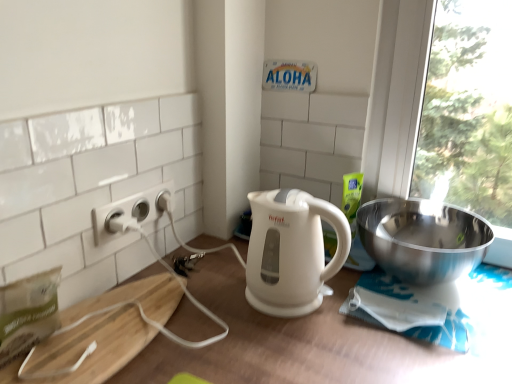
What do you see at coordinates (298, 343) in the screenshot? I see `white matte table at center` at bounding box center [298, 343].

Locate an element on the screen. white glossy electric kettle at center is located at coordinates (291, 251).

Locate an element on the screen. This screenshot has width=512, height=384. white plastic power outlet at left is located at coordinates (130, 213).

Image resolution: width=512 pixels, height=384 pixels. Find the location of `polished stainless steel bowl at right`. polished stainless steel bowl at right is located at coordinates (423, 239).

Where is `white matte table at center`? The width and height of the screenshot is (512, 384). white matte table at center is located at coordinates (298, 343).

Is white plastic power outlet at left turned away from white matte table at center?

No, white plastic power outlet at left is not facing away from white matte table at center.

Is white plastic power outlet at left beside white matte table at center?

white plastic power outlet at left is not next to white matte table at center, and they're not touching.

From the image's perspective, is white plastic power outlet at left on top of white matte table at center?

Yes, from the image's perspective, white plastic power outlet at left is above white matte table at center.

In the scene shown: Can you confirm if white plastic power outlet at left is bigger than white matte table at center?

Incorrect, white plastic power outlet at left is not larger than white matte table at center.

Considering the positions of objects white matte table at center and white glossy electric kettle at center in the image provided, who is more to the right, white matte table at center or white glossy electric kettle at center?

From the viewer's perspective, white matte table at center appears more on the right side.

Relative to white glossy electric kettle at center, is white matte table at center in front or behind?

In the image, white matte table at center appears in front of white glossy electric kettle at center.

From the image's perspective, which one is positioned lower, white matte table at center or white glossy electric kettle at center?

white matte table at center appears lower in the image.

From the picture: Is white matte table at center turned away from white glossy electric kettle at center?

No, white matte table at center's orientation is not away from white glossy electric kettle at center.

Considering the sizes of objects white matte table at center and polished stainless steel bowl at right in the image provided, who is taller, white matte table at center or polished stainless steel bowl at right?

Answer: white matte table at center.

What's the angular difference between white matte table at center and polished stainless steel bowl at right's facing directions?

They differ by 0.000495 degrees in their facing directions.

Which of these two, white matte table at center or polished stainless steel bowl at right, is wider?

Wider between the two is white matte table at center.

Based on their positions, is white glossy electric kettle at center located to the left or right of white matte table at center?

white glossy electric kettle at center is to the left of white matte table at center.

Which of these two, white glossy electric kettle at center or white matte table at center, stands shorter?

Standing shorter between the two is white glossy electric kettle at center.

Considering the relative positions of white glossy electric kettle at center and white matte table at center in the image provided, is white glossy electric kettle at center behind white matte table at center?

Yes, white glossy electric kettle at center is behind white matte table at center.

Is white glossy electric kettle at center facing away from white matte table at center?

No.

Would you say white plastic power outlet at left contains white glossy electric kettle at center?

No, white glossy electric kettle at center is not surrounded by white plastic power outlet at left.

Who is taller, white plastic power outlet at left or white glossy electric kettle at center?

white glossy electric kettle at center is taller.

From a real-world perspective, is white plastic power outlet at left above or below white glossy electric kettle at center?

In terms of real-world spatial position, white plastic power outlet at left is above white glossy electric kettle at center.

Locate an element on the screen. The width and height of the screenshot is (512, 384). power outlet above the white glossy electric kettle at center (from the image's perspective) is located at coordinates (130, 213).

Between polished stainless steel bowl at right and white matte table at center, which one has more height?

Standing taller between the two is white matte table at center.

Consider the image. Is polished stainless steel bowl at right to the right of white matte table at center from the viewer's perspective?

Correct, you'll find polished stainless steel bowl at right to the right of white matte table at center.

Find the location of a particular element. table in front of the polished stainless steel bowl at right is located at coordinates (298, 343).

Is polished stainless steel bowl at right wider than white matte table at center?

No.

How far apart are polished stainless steel bowl at right and white plastic power outlet at left?

The distance of polished stainless steel bowl at right from white plastic power outlet at left is 23.48 inches.

Is polished stainless steel bowl at right in front of or behind white plastic power outlet at left in the image?

polished stainless steel bowl at right is in front of white plastic power outlet at left.

Is polished stainless steel bowl at right inside the boundaries of white plastic power outlet at left, or outside?

The correct answer is: outside.

From the image's perspective, which is below, polished stainless steel bowl at right or white plastic power outlet at left?

polished stainless steel bowl at right.

Where is `power outlet located above the white matte table at center (from the image's perspective)`? power outlet located above the white matte table at center (from the image's perspective) is located at coordinates (130, 213).

This screenshot has width=512, height=384. I want to click on table below the white glossy electric kettle at center (from the image's perspective), so click(298, 343).

From the image, which object appears to be nearer to white plastic power outlet at left, polished stainless steel bowl at right or white glossy electric kettle at center?

white glossy electric kettle at center is closer to white plastic power outlet at left.

Looking at the image, which one is located closer to polished stainless steel bowl at right, white plastic power outlet at left or white matte table at center?

Among the two, white matte table at center is located nearer to polished stainless steel bowl at right.

Estimate the real-world distances between objects in this image. Which object is closer to polished stainless steel bowl at right, white glossy electric kettle at center or white plastic power outlet at left?

Based on the image, white glossy electric kettle at center appears to be nearer to polished stainless steel bowl at right.

Based on the photo, considering their positions, is white matte table at center positioned closer to white glossy electric kettle at center than polished stainless steel bowl at right?

white matte table at center lies closer to white glossy electric kettle at center than the other object.

Based on their spatial positions, is white matte table at center or polished stainless steel bowl at right closer to white plastic power outlet at left?

Among the two, white matte table at center is located nearer to white plastic power outlet at left.

Based on their spatial positions, is white plastic power outlet at left or white glossy electric kettle at center further from polished stainless steel bowl at right?

white plastic power outlet at left is positioned further to the anchor polished stainless steel bowl at right.

When comparing their distances from white glossy electric kettle at center, does white plastic power outlet at left or polished stainless steel bowl at right seem further?

Among the two, white plastic power outlet at left is located further to white glossy electric kettle at center.

Based on their spatial positions, is white glossy electric kettle at center or white plastic power outlet at left further from white matte table at center?

white plastic power outlet at left lies further to white matte table at center than the other object.

The width and height of the screenshot is (512, 384). I want to click on table situated between white plastic power outlet at left and polished stainless steel bowl at right from left to right, so click(298, 343).

This screenshot has height=384, width=512. What are the coordinates of `bowl that lies between white glossy electric kettle at center and white matte table at center from top to bottom` in the screenshot? It's located at (423, 239).

Identify the location of kitchen appliance located between white plastic power outlet at left and polished stainless steel bowl at right in the left-right direction. The height and width of the screenshot is (384, 512). (291, 251).

Where is `kitchen appliance between white plastic power outlet at left and white matte table at center in the vertical direction`? The height and width of the screenshot is (384, 512). kitchen appliance between white plastic power outlet at left and white matte table at center in the vertical direction is located at coordinates (291, 251).